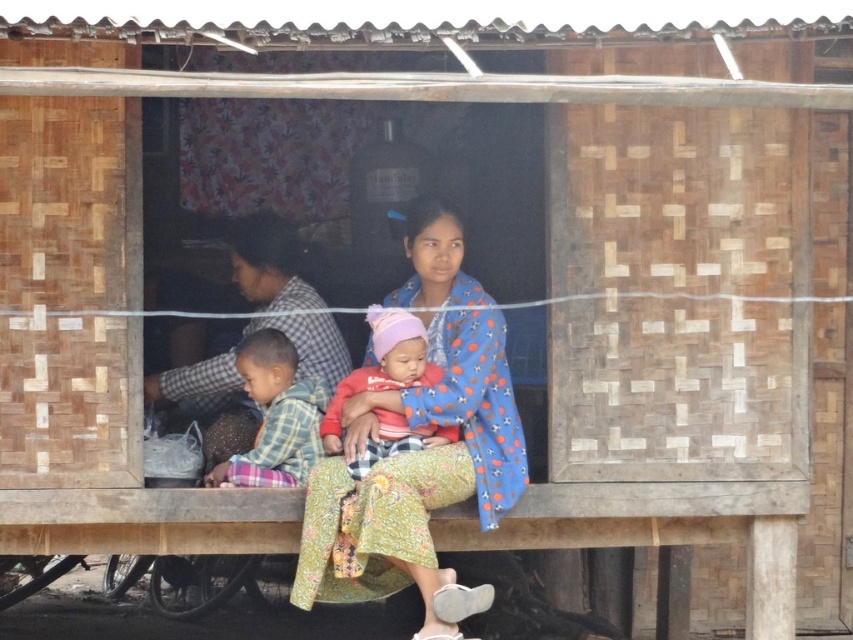
Is floral fabric dress at center behind red cotton baby at center?

No, it is in front of red cotton baby at center.

Is point (447, 282) closer to camera compared to point (405, 380)?

No, it is behind (405, 380).

Which is in front, point (389, 540) or point (396, 355)?

Positioned in front is point (389, 540).

Identify the location of floral fabric dress at center. The width and height of the screenshot is (853, 640). tap(419, 429).

Which is behind, point (408, 556) or point (227, 477)?

Positioned behind is point (227, 477).

Can you confirm if floral fabric dress at center is thinner than plaid fabric shirt at lower left?

Incorrect, floral fabric dress at center's width is not less than plaid fabric shirt at lower left's.

Where is `floral fabric dress at center`? floral fabric dress at center is located at coordinates (419, 429).

Who is positioned more to the right, plaid fabric shirt at lower left or red cotton baby at center?

From the viewer's perspective, red cotton baby at center appears more on the right side.

At what (x,y) coordinates should I click in order to perform the action: click on plaid fabric shirt at lower left. Please return your answer as a coordinate pair (x, y). The image size is (853, 640). Looking at the image, I should click on (276, 416).

This screenshot has height=640, width=853. I want to click on plaid fabric shirt at lower left, so click(276, 416).